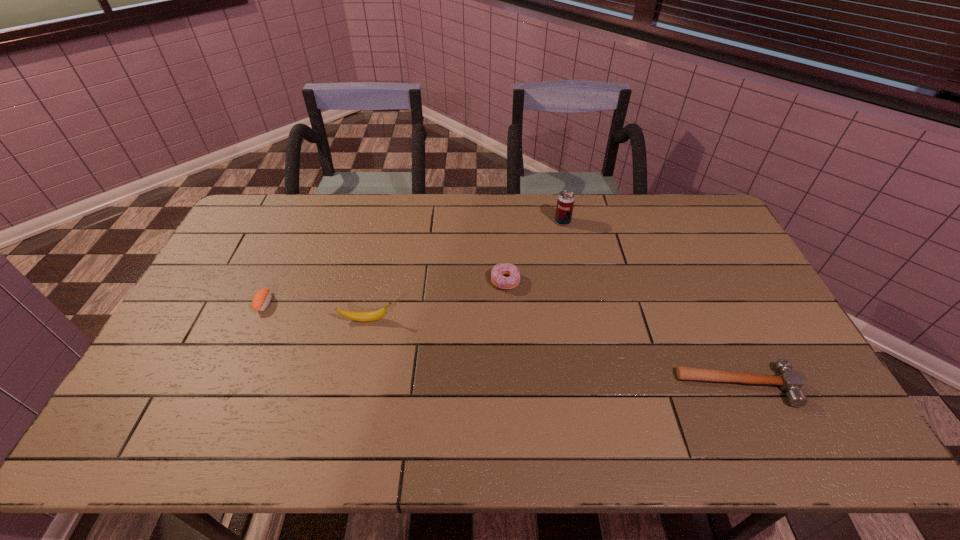
I want to click on vacant space located on the left of the doughnut, so click(x=367, y=281).

You are a GUI agent. You are given a task and a screenshot of the screen. Output one action in this format:
    pyautogui.click(x=<x>, y=<y>)
    Task: Click on the free space located on the right of the leftmost object
    The image size is (960, 540).
    Given the screenshot: What is the action you would take?
    pyautogui.click(x=385, y=303)

The width and height of the screenshot is (960, 540). Identify the location of vacant space situated on the back of the nearest object. (696, 294).

This screenshot has height=540, width=960. I want to click on object that is at the far edge, so click(x=565, y=203).

At what (x,y) coordinates should I click in order to perform the action: click on object that is at the right edge. Please return your answer as a coordinate pair (x, y). Image resolution: width=960 pixels, height=540 pixels. Looking at the image, I should click on (791, 382).

In the image, there is a desktop. Identify the location of vacant region at the far edge. This screenshot has width=960, height=540. (578, 225).

Locate an element on the screen. blank space at the left edge of the desktop is located at coordinates (188, 332).

This screenshot has width=960, height=540. What are the coordinates of `vacant region at the right edge of the desktop` in the screenshot? It's located at (751, 333).

Locate an element on the screen. The image size is (960, 540). vacant space at the near left corner of the desktop is located at coordinates (149, 419).

Where is `vacant position at the far right corner of the desktop`? vacant position at the far right corner of the desktop is located at coordinates (689, 226).